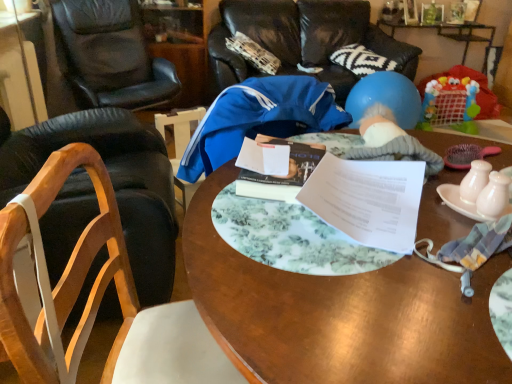
Where is `vacant space that is in between white paper at center and pink ceramic plate at right`? vacant space that is in between white paper at center and pink ceramic plate at right is located at coordinates (448, 228).